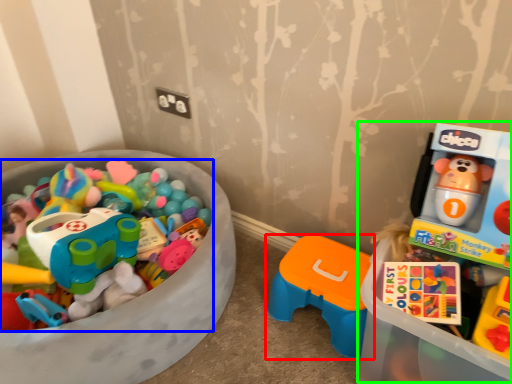
Question: Based on their relative distances, which object is nearer to toy (highlighted by a red box)? Choose from toy (highlighted by a blue box) and toyshop (highlighted by a green box).

Choices:
 (A) toy
 (B) toyshop

Answer: (B)